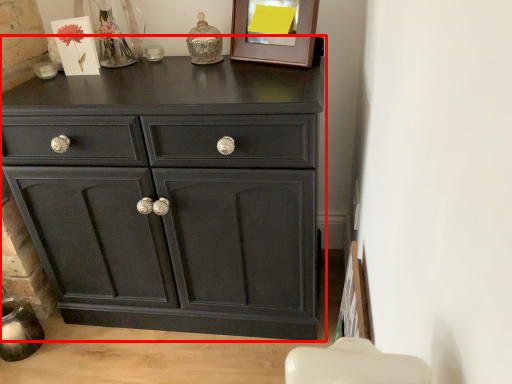
Question: From the image's perspective, considering the relative positions of chest of drawers (annotated by the red box) and picture frame in the image provided, where is chest of drawers (annotated by the red box) located with respect to the staircase?

Choices:
 (A) below
 (B) above

Answer: (A)